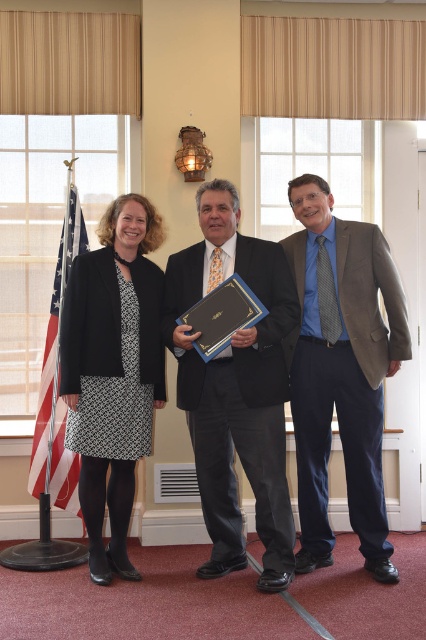
Question: Which is farther from the matte black suit at center?

Choices:
 (A) american flag at left
 (B) black textured dress at left
 (C) blue textured shirt at center
 (D) blue glossy plaque at center

Answer: (A)

Question: Is matte black suit at center below blue glossy plaque at center?

Choices:
 (A) yes
 (B) no

Answer: (A)

Question: Which point appears closest to the camera in this image?

Choices:
 (A) (249, 296)
 (B) (28, 470)
 (C) (371, 246)

Answer: (A)

Question: Is blue textured shirt at center thinner than american flag at left?

Choices:
 (A) no
 (B) yes

Answer: (A)

Question: Which of these objects is positioned farthest from the matte black suit at center?

Choices:
 (A) blue textured shirt at center
 (B) american flag at left
 (C) blue glossy plaque at center
 (D) black textured dress at left

Answer: (B)

Question: Does black textured dress at left have a larger size compared to american flag at left?

Choices:
 (A) yes
 (B) no

Answer: (A)